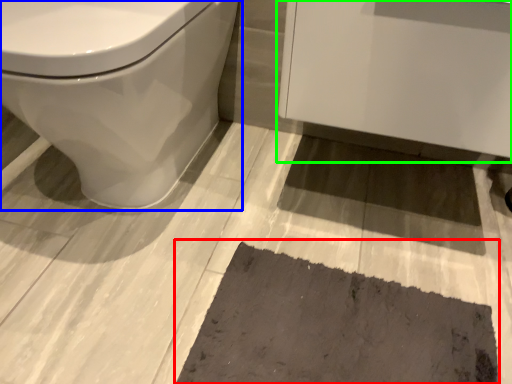
Question: Which object is positioned farthest from bath mat (highlighted by a red box)? Select from toilet (highlighted by a blue box) and porcelain (highlighted by a green box).

Choices:
 (A) toilet
 (B) porcelain

Answer: (A)